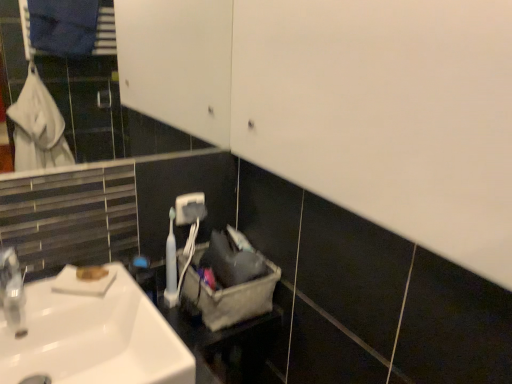
Question: Would you say gray fabric laundry basket at center is outside white glossy sink at lower left?

Choices:
 (A) yes
 (B) no

Answer: (A)

Question: From the image's perspective, does gray fabric laundry basket at center appear lower than white glossy sink at lower left?

Choices:
 (A) yes
 (B) no

Answer: (B)

Question: Can you confirm if gray fabric laundry basket at center is positioned to the left of white glossy sink at lower left?

Choices:
 (A) no
 (B) yes

Answer: (A)

Question: Is gray fabric laundry basket at center aimed at white glossy sink at lower left?

Choices:
 (A) yes
 (B) no

Answer: (B)

Question: Does gray fabric laundry basket at center appear on the right side of white glossy sink at lower left?

Choices:
 (A) no
 (B) yes

Answer: (B)

Question: Is white glossy sink at lower left taller or shorter than white plastic toothbrush at center?

Choices:
 (A) short
 (B) tall

Answer: (A)

Question: Is white glossy sink at lower left bigger or smaller than white plastic toothbrush at center?

Choices:
 (A) small
 (B) big

Answer: (B)

Question: Is white glossy sink at lower left to the left or to the right of white plastic toothbrush at center in the image?

Choices:
 (A) right
 (B) left

Answer: (B)

Question: From the image's perspective, is white glossy sink at lower left above or below white plastic toothbrush at center?

Choices:
 (A) above
 (B) below

Answer: (B)

Question: In terms of size, does gray fabric laundry basket at center appear bigger or smaller than white matte soap at lower left?

Choices:
 (A) big
 (B) small

Answer: (A)

Question: Is gray fabric laundry basket at center in front of or behind white matte soap at lower left in the image?

Choices:
 (A) behind
 (B) front

Answer: (A)

Question: Is point (266, 301) positioned closer to the camera than point (83, 266)?

Choices:
 (A) closer
 (B) farther

Answer: (B)

Question: From a real-world perspective, is gray fabric laundry basket at center positioned above or below white matte soap at lower left?

Choices:
 (A) above
 (B) below

Answer: (B)

Question: Based on their positions, is white plastic toothbrush at center located to the left or right of white matte soap at lower left?

Choices:
 (A) right
 (B) left

Answer: (A)

Question: Is white plastic toothbrush at center bigger or smaller than white matte soap at lower left?

Choices:
 (A) small
 (B) big

Answer: (B)